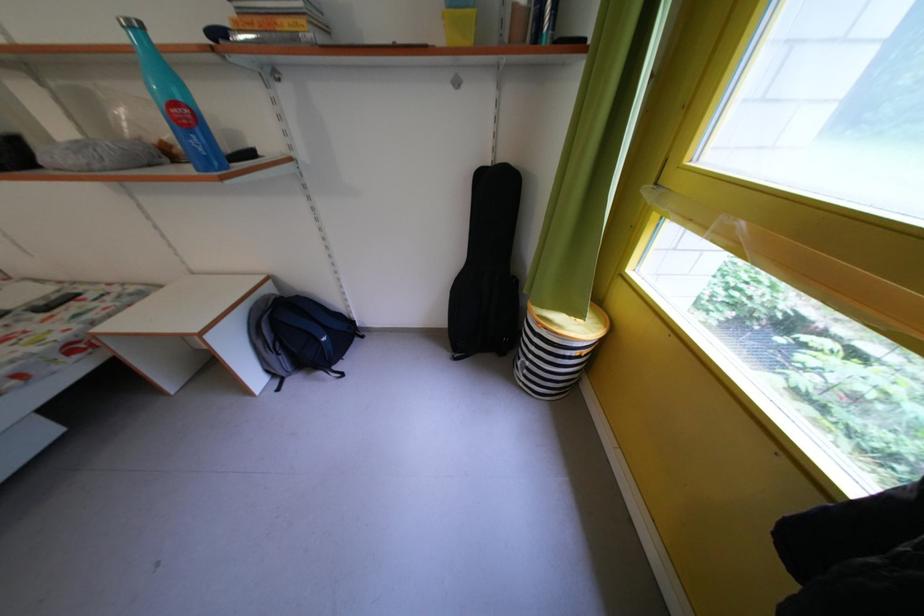
Describe the element at coordinates (456, 81) in the screenshot. Image resolution: width=924 pixels, height=616 pixels. I see `the silver bottle cap` at that location.